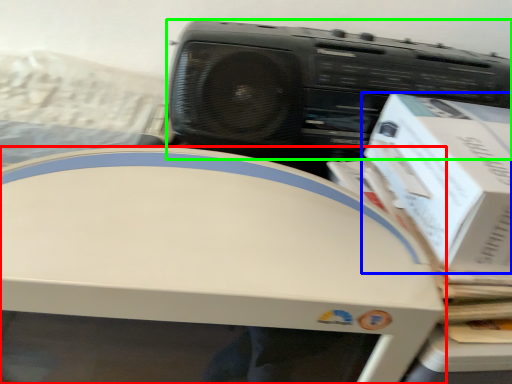
Question: Based on their relative distances, which object is nearer to home appliance (highlighted by a red box)? Choose from box (highlighted by a blue box) and cassette (highlighted by a green box).

Choices:
 (A) box
 (B) cassette

Answer: (A)